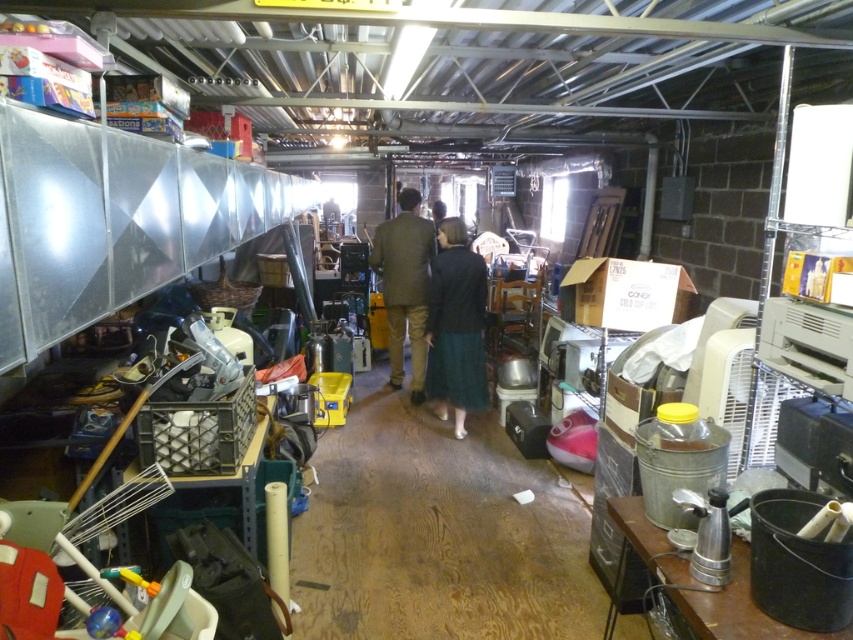
Between dark green skirt at center and brown wool coat at center, which one appears on the left side from the viewer's perspective?

From the viewer's perspective, brown wool coat at center appears more on the left side.

Which is below, dark green skirt at center or brown wool coat at center?

dark green skirt at center is below.

Measure the distance between dark green skirt at center and camera.

They are 14.82 feet apart.

The image size is (853, 640). Identify the location of dark green skirt at center. (456, 326).